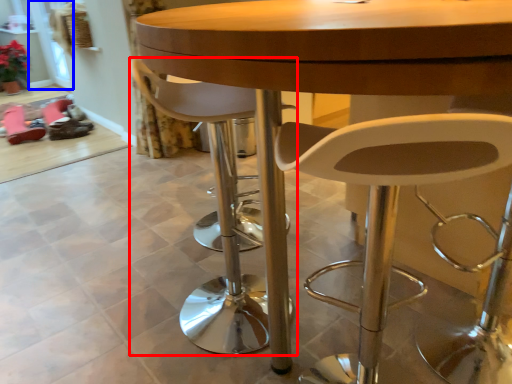
Question: Among these objects, which one is farthest to the camera, chair (highlighted by a red box) or glass door (highlighted by a blue box)?

Choices:
 (A) chair
 (B) glass door

Answer: (B)